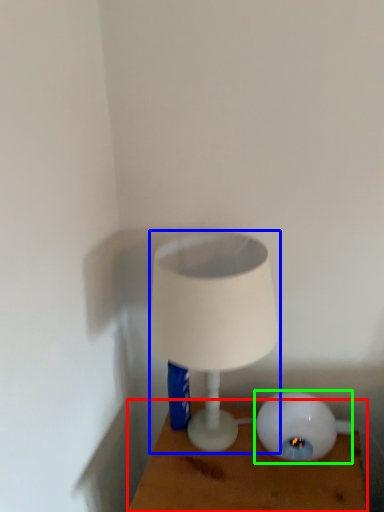
Question: Which object is the farthest from furniture (highlighted by a red box)? Choose among these: lamp (highlighted by a blue box) or lamp (highlighted by a green box).

Choices:
 (A) lamp
 (B) lamp

Answer: (A)